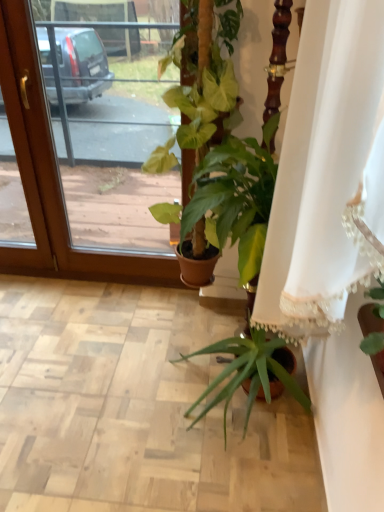
Question: Is green glossy plant at center inside or outside of white lace curtain at center?

Choices:
 (A) inside
 (B) outside

Answer: (B)

Question: In terms of width, does green glossy plant at center look wider or thinner when compared to white lace curtain at center?

Choices:
 (A) thin
 (B) wide

Answer: (A)

Question: Which object is the closest to the transparent glass screen door at upper left?

Choices:
 (A) green glossy plant at center
 (B) white lace curtain at center

Answer: (A)

Question: Estimate the real-world distances between objects in this image. Which object is farther from the green glossy plant at center?

Choices:
 (A) white lace curtain at center
 (B) transparent glass screen door at upper left

Answer: (B)